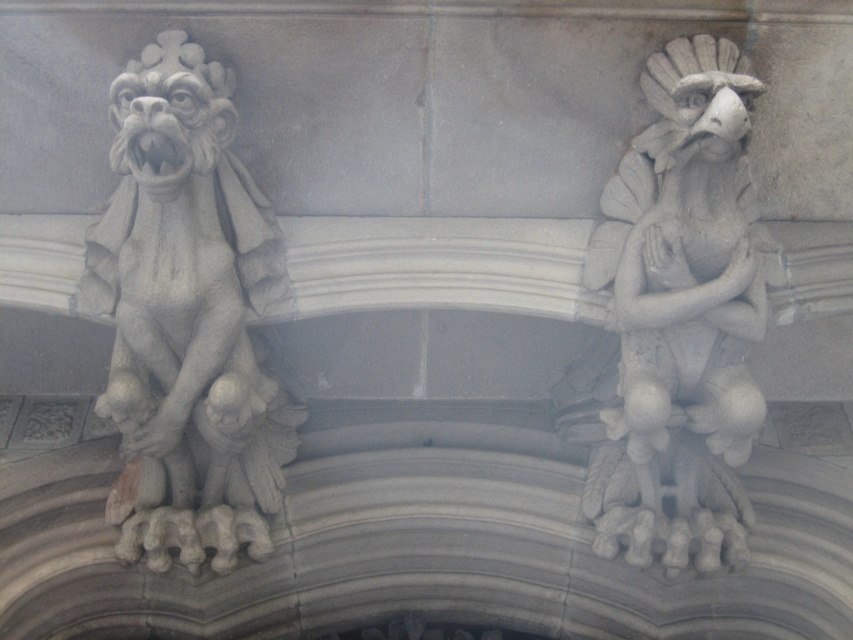
Does gray stone gargoyle at left appear on the left side of white stone gargoyle at right?

Indeed, gray stone gargoyle at left is positioned on the left side of white stone gargoyle at right.

Is point (184, 72) less distant than point (723, 493)?

That is True.

You are a GUI agent. You are given a task and a screenshot of the screen. Output one action in this format:
    pyautogui.click(x=<x>, y=<y>)
    Task: Click on the gray stone gargoyle at left
    This screenshot has width=853, height=640.
    Given the screenshot: What is the action you would take?
    pyautogui.click(x=186, y=317)